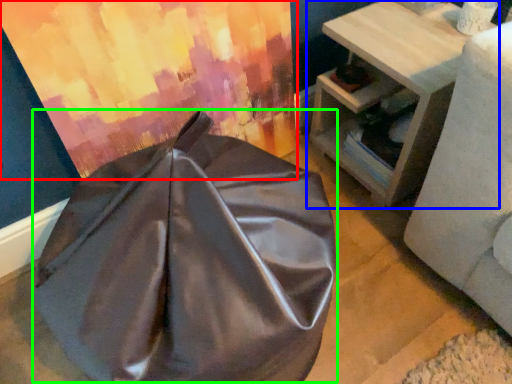
Question: Which object is the closest to the curtain (highlighted by a red box)? Choose among these: table (highlighted by a blue box) or bean bag chair (highlighted by a green box).

Choices:
 (A) table
 (B) bean bag chair

Answer: (B)